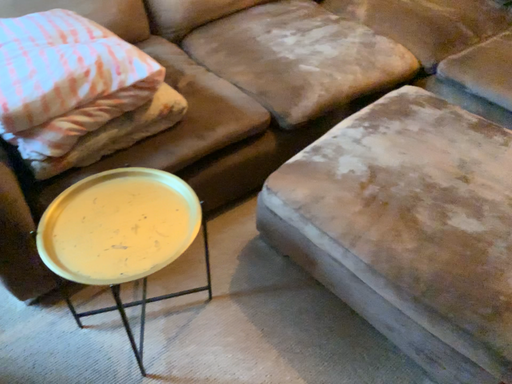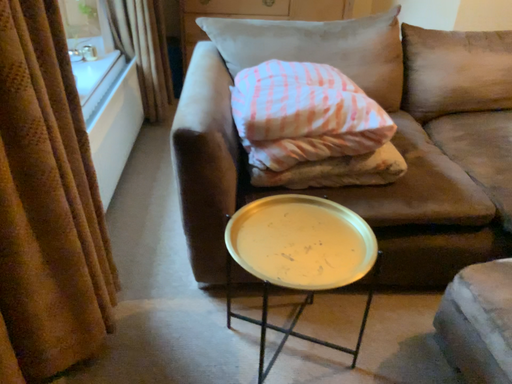
Question: How did the camera likely rotate when shooting the video?

Choices:
 (A) rotated upward
 (B) rotated downward

Answer: (A)